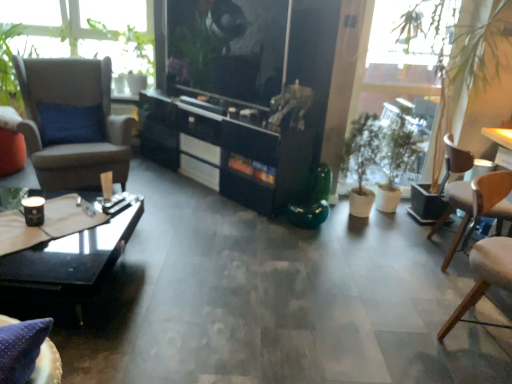
The image size is (512, 384). Describe the element at coordinates (366, 64) in the screenshot. I see `green matte plant at right` at that location.

Describe the element at coordinates (501, 144) in the screenshot. I see `wooden table at right` at that location.

At what (x,y) coordinates should I click in order to perform the action: click on brown leather armchair at left, placed as the 2th chair when sorted from right to left. Please return your answer as a coordinate pair (x, y). The width and height of the screenshot is (512, 384). Looking at the image, I should click on (77, 107).

What is the approximate width of green matte plant at right?

green matte plant at right is 13.47 inches in width.

Image resolution: width=512 pixels, height=384 pixels. In order to click on green matte plant at right in this screenshot , I will do click(x=366, y=64).

Between green matte plant at right and black glossy cabinet at center, which one has smaller size?

With smaller size is green matte plant at right.

This screenshot has width=512, height=384. What are the coordinates of `cabinetry lying on the left of green matte plant at right` in the screenshot? It's located at (228, 151).

Would you say black glossy cabinet at center is part of green matte plant at right's contents?

Actually, black glossy cabinet at center is outside green matte plant at right.

Considering the positions of points (101, 239) and (510, 133), is point (101, 239) farther from camera compared to point (510, 133)?

No.

Is black glass coffee table at lower left far from wooden table at right?

Absolutely, black glass coffee table at lower left is distant from wooden table at right.

Can you confirm if black glass coffee table at lower left is shorter than wooden table at right?

Yes.

Is black glass coffee table at lower left facing away from wooden table at right?

black glass coffee table at lower left does not have its back to wooden table at right.

From their relative heights in the image, would you say black glass coffee table at lower left is taller or shorter than green matte plant at right?

In the image, black glass coffee table at lower left appears to be shorter than green matte plant at right.

From a real-world perspective, does black glass coffee table at lower left sit lower than green matte plant at right?

Correct, in the physical world, black glass coffee table at lower left is lower than green matte plant at right.

Considering the positions of objects black glass coffee table at lower left and green matte plant at right in the image provided, who is more to the right, black glass coffee table at lower left or green matte plant at right?

Positioned to the right is green matte plant at right.

From the image's perspective, is black glass coffee table at lower left positioned above or below green matte plant at right?

From the image's perspective, black glass coffee table at lower left appears below green matte plant at right.

Who is shorter, brown leather armchair at left, placed as the 2th chair when sorted from right to left, or black glass coffee table at lower left?

black glass coffee table at lower left.

Can you tell me how much brown leather armchair at left, placed as the 2th chair when sorted from right to left, and black glass coffee table at lower left differ in facing direction?

27.6 degrees separate the facing orientations of brown leather armchair at left, placed as the 2th chair when sorted from right to left, and black glass coffee table at lower left.

Considering the sizes of objects brown leather armchair at left, placed as the 2th chair when sorted from right to left, and black glass coffee table at lower left in the image provided, who is wider, brown leather armchair at left, placed as the 2th chair when sorted from right to left, or black glass coffee table at lower left?

black glass coffee table at lower left is wider.

Would you say brown leather armchair at left, which appears as the 1th chair when viewed from the left, is inside or outside black glass coffee table at lower left?

brown leather armchair at left, which appears as the 1th chair when viewed from the left, is not enclosed by black glass coffee table at lower left.

Between brown leather armchair at left, which appears as the 1th chair when viewed from the left, and green matte plant at right, which one has less height?

→ Standing shorter between the two is brown leather armchair at left, which appears as the 1th chair when viewed from the left.

From the image's perspective, which one is positioned lower, brown leather armchair at left, which appears as the 1th chair when viewed from the left, or green matte plant at right?

brown leather armchair at left, which appears as the 1th chair when viewed from the left, is shown below in the image.

Which object is further away from the camera, brown leather armchair at left, which appears as the 1th chair when viewed from the left, or green matte plant at right?

Positioned behind is brown leather armchair at left, which appears as the 1th chair when viewed from the left.

Would you say brown leather armchair at left, which appears as the 1th chair when viewed from the left, is outside green matte plant at right?

That's correct, brown leather armchair at left, which appears as the 1th chair when viewed from the left, is outside of green matte plant at right.

Is light brown wooden chair at right, which appears as the first chair when viewed from the right, oriented towards brown leather armchair at left, placed as the 2th chair when sorted from right to left?

No, light brown wooden chair at right, which appears as the first chair when viewed from the right, is not facing towards brown leather armchair at left, placed as the 2th chair when sorted from right to left.

Between light brown wooden chair at right, which appears as the first chair when viewed from the right, and brown leather armchair at left, placed as the 2th chair when sorted from right to left, which one is positioned behind?

brown leather armchair at left, placed as the 2th chair when sorted from right to left, is further from the camera.

Which object is thinner, light brown wooden chair at right, placed as the 2th chair when sorted from left to right, or brown leather armchair at left, which appears as the 1th chair when viewed from the left?

Thinner between the two is light brown wooden chair at right, placed as the 2th chair when sorted from left to right.

Would you say green matte plant at right is a long distance from light brown wooden chair at right, which appears as the first chair when viewed from the right?

That's right, there is a large distance between green matte plant at right and light brown wooden chair at right, which appears as the first chair when viewed from the right.

From the image's perspective, which object appears higher, green matte plant at right or light brown wooden chair at right, which appears as the first chair when viewed from the right?

From the image's view, green matte plant at right is above.

Is green matte plant at right positioned in front of light brown wooden chair at right, which appears as the first chair when viewed from the right?

No, it is behind light brown wooden chair at right, which appears as the first chair when viewed from the right.

Where is `cabinetry above the green matte plant at right (from the image's perspective)`? The image size is (512, 384). cabinetry above the green matte plant at right (from the image's perspective) is located at coordinates point(228,151).

There is a black glass coffee table at lower left. Identify the location of table above it (from a real-world perspective). The image size is (512, 384). (501, 144).

From the image, which object appears to be farther from wooden table at right, black glossy cabinet at center or green matte plant at right?

Based on the image, black glossy cabinet at center appears to be further to wooden table at right.

When comparing their distances from green matte plant at right, does wooden table at right or brown leather armchair at left, placed as the 2th chair when sorted from right to left, seem further?

Among the two, brown leather armchair at left, placed as the 2th chair when sorted from right to left, is located further to green matte plant at right.

When comparing their distances from green matte plant at right, does green matte plant at right or wooden table at right seem further?

wooden table at right.

Considering their positions, is light brown wooden chair at right, placed as the 2th chair when sorted from left to right, positioned further to black glossy cabinet at center than green matte plant at right?

light brown wooden chair at right, placed as the 2th chair when sorted from left to right, lies further to black glossy cabinet at center than the other object.

Looking at the image, which one is located closer to brown leather armchair at left, which appears as the 1th chair when viewed from the left, green matte plant at right or black glass coffee table at lower left?

Based on the image, black glass coffee table at lower left appears to be nearer to brown leather armchair at left, which appears as the 1th chair when viewed from the left.

Looking at the image, which one is located closer to brown leather armchair at left, which appears as the 1th chair when viewed from the left, green matte plant at right or green matte plant at right?

green matte plant at right is positioned closer to the anchor brown leather armchair at left, which appears as the 1th chair when viewed from the left.

From the image, which object appears to be nearer to wooden table at right, green matte plant at right or brown leather armchair at left, placed as the 2th chair when sorted from right to left?

Among the two, green matte plant at right is located nearer to wooden table at right.

Considering their positions, is green matte plant at right positioned further to black glass coffee table at lower left than light brown wooden chair at right, placed as the 2th chair when sorted from left to right?

light brown wooden chair at right, placed as the 2th chair when sorted from left to right.

This screenshot has height=384, width=512. Identify the location of coffee table located between brown leather armchair at left, which appears as the 1th chair when viewed from the left, and green matte plant at right in the left-right direction. (71, 261).

Where is `houseplant situated between brown leather armchair at left, placed as the 2th chair when sorted from right to left, and light brown wooden chair at right, which appears as the first chair when viewed from the right, from left to right`? This screenshot has height=384, width=512. houseplant situated between brown leather armchair at left, placed as the 2th chair when sorted from right to left, and light brown wooden chair at right, which appears as the first chair when viewed from the right, from left to right is located at coordinates (379, 148).

Image resolution: width=512 pixels, height=384 pixels. What are the coordinates of `houseplant between black glass coffee table at lower left and green matte plant at right in the horizontal direction` in the screenshot? It's located at (379, 148).

Where is `cabinetry between black glass coffee table at lower left and green matte plant at right in the horizontal direction`? The height and width of the screenshot is (384, 512). cabinetry between black glass coffee table at lower left and green matte plant at right in the horizontal direction is located at coordinates (228, 151).